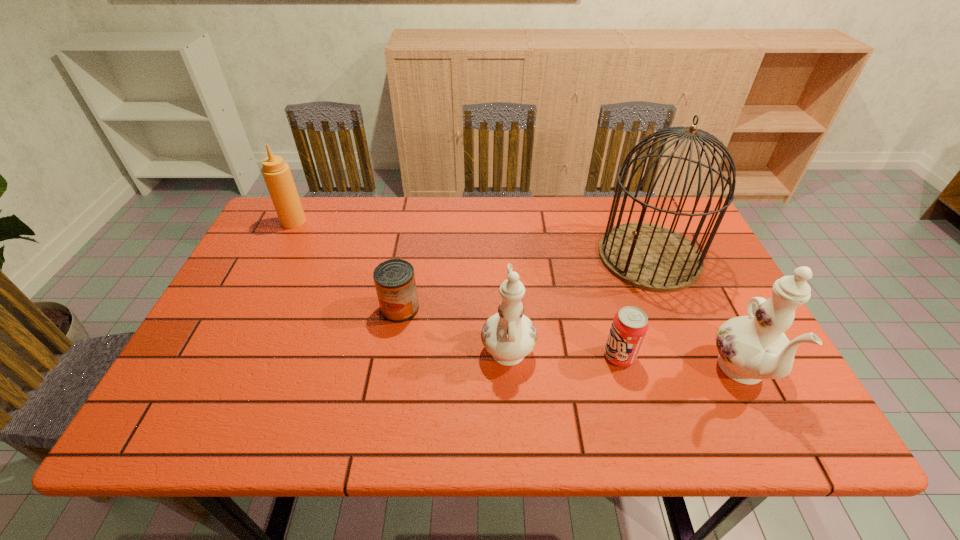
Locate an element on the screen. The height and width of the screenshot is (540, 960). empty location between the birdcage and the fifth object from right to left is located at coordinates (525, 282).

The image size is (960, 540). Identify the location of vacant point located between the right chinaware and the second object from left to right. (572, 341).

Locate an element on the screen. This screenshot has height=540, width=960. vacant space in between the soda can and the condiment is located at coordinates (457, 288).

The image size is (960, 540). Identify the location of empty space that is in between the right chinaware and the second object from left to right. (572, 341).

Locate an element on the screen. This screenshot has height=540, width=960. vacant space that's between the soda can and the leftmost object is located at coordinates (457, 288).

In order to click on vacant space that is in between the birdcage and the leftmost object in this screenshot , I will do `click(471, 239)`.

Where is `vacant area that lies between the soda can and the tallest object`? The width and height of the screenshot is (960, 540). vacant area that lies between the soda can and the tallest object is located at coordinates (635, 306).

Locate an element on the screen. blank region between the leftmost object and the birdcage is located at coordinates (471, 239).

In order to click on object that ranks as the second closest to the left chinaware in this screenshot , I will do `click(394, 279)`.

This screenshot has height=540, width=960. Find the location of `the closest object to the taller chinaware`. the closest object to the taller chinaware is located at coordinates (630, 325).